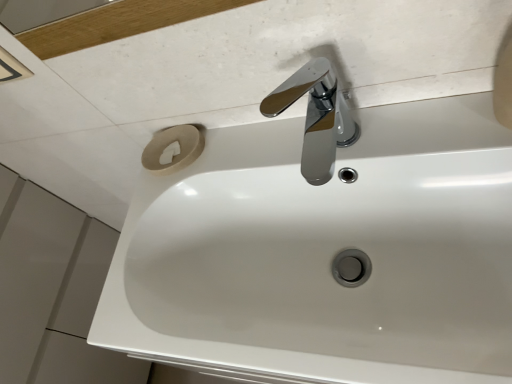
At what (x,y) coordinates should I click in order to perform the action: click on vacant location below white glossy sink at center (from a real-world perspective). Please return your answer as a coordinate pair (x, y). Looking at the image, I should click on (334, 266).